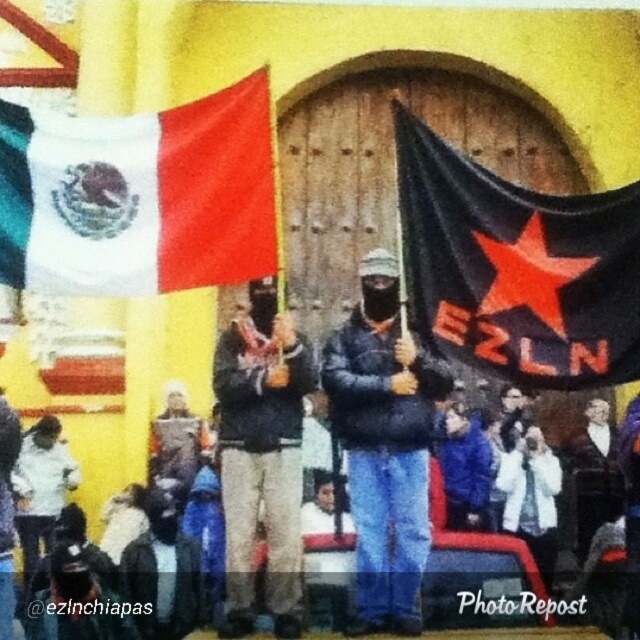
You are a photographer at the protest scene. You want to take a photo of the dark gray fabric jacket at center without the white fabric flag at upper left blocking it. What should you do?

Move to the side so that the white fabric flag at upper left is no longer in front of the dark gray fabric jacket at center. Since the white fabric flag at upper left is currently in front of the dark gray fabric jacket at center, moving your position can adjust the perspective to exclude the flag from blocking the jacket.

You are a photographer at the event and want to capture both the white fabric flag at upper left and the dark gray fabric jacket at center in a single frame. Which object should you focus on first to ensure both are in the frame?

The white fabric flag at upper left is shorter than the dark gray fabric jacket at center, so you should focus on the dark gray fabric jacket at center first to ensure both are in the frame.

You are a photographer taking a picture of the protest scene. You notice the white fabric flag at upper left and the dark gray fabric jacket at center. Which object is closer to the camera?

The white fabric flag at upper left is positioned over the dark gray fabric jacket at center, meaning it is closer to the camera.